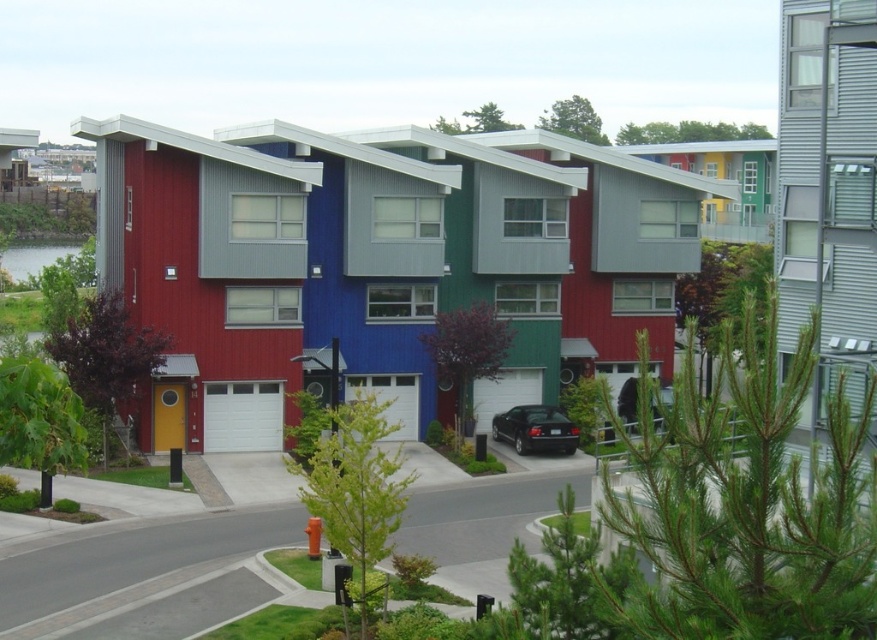
From the picture: Does black glossy car at center appear over clear water at lower left?

Actually, black glossy car at center is below clear water at lower left.

Does point (523, 404) lie behind point (88, 244)?

No, (523, 404) is closer to viewer.

Between point (501, 436) and point (39, 250), which one is positioned in front?

Point (501, 436) is in front.

I want to click on black glossy car at center, so click(535, 429).